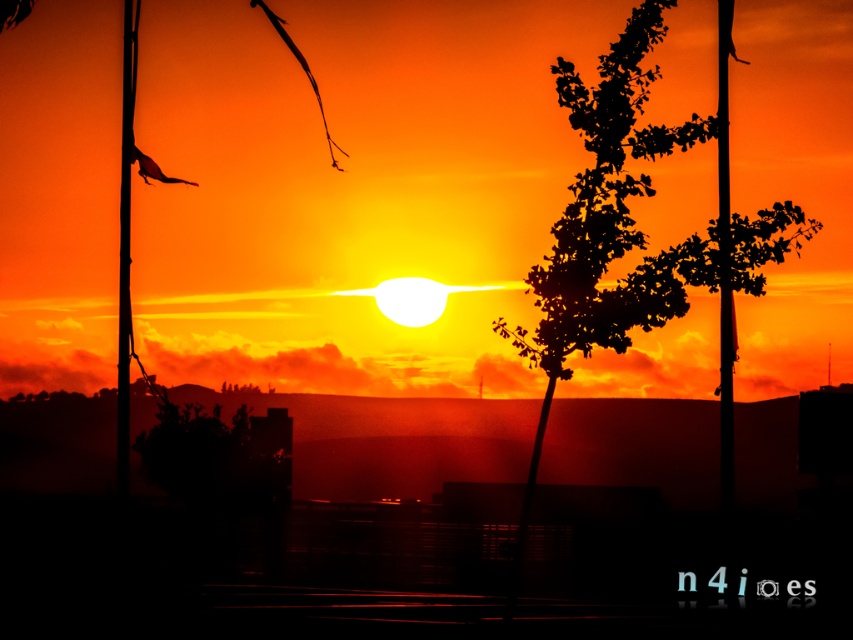
Question: Which object is farther from the camera taking this photo?

Choices:
 (A) silhouette leafy tree at center
 (B) black matte pole at center
 (C) smooth metal pole at left

Answer: (C)

Question: Does black matte pole at center appear under smooth metal pole at left?

Choices:
 (A) no
 (B) yes

Answer: (B)

Question: Is silhouette leafy tree at center wider than black matte pole at center?

Choices:
 (A) yes
 (B) no

Answer: (A)

Question: Which object is positioned closest to the silhouette leafy tree at center?

Choices:
 (A) black matte pole at center
 (B) smooth metal pole at left

Answer: (A)

Question: Which object is positioned closest to the silhouette leafy tree at center?

Choices:
 (A) black matte pole at center
 (B) smooth metal pole at left

Answer: (A)

Question: Does black matte pole at center appear over smooth metal pole at left?

Choices:
 (A) no
 (B) yes

Answer: (A)